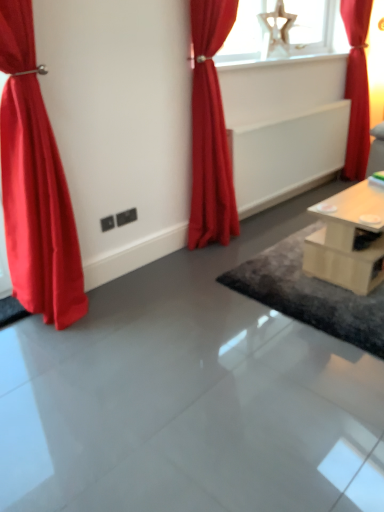
Question: From a real-world perspective, is light wood table at right above or below matte red curtain at left, acting as the 3th curtain starting from the back?

Choices:
 (A) below
 (B) above

Answer: (A)

Question: Does point (352, 242) appear closer or farther from the camera than point (16, 220)?

Choices:
 (A) closer
 (B) farther

Answer: (B)

Question: Based on their relative distances, which object is farther from the dark gray textured rug at center?

Choices:
 (A) red velvet curtain at upper right, which is the 1th curtain from back to front
 (B) matte red curtain at left, which ranks as the third curtain in right-to-left order
 (C) light wood table at right
 (D) white glossy radiator at upper center
 (E) matte red curtain at center, which is the 2th curtain from back to front

Answer: (A)

Question: Which of these objects is positioned farthest from the light wood table at right?

Choices:
 (A) matte red curtain at left, acting as the 3th curtain starting from the back
 (B) red velvet curtain at upper right, which is counted as the 3th curtain, starting from the left
 (C) white glossy radiator at upper center
 (D) matte red curtain at center, positioned as the second curtain in left-to-right order
 (E) dark gray textured rug at center

Answer: (B)